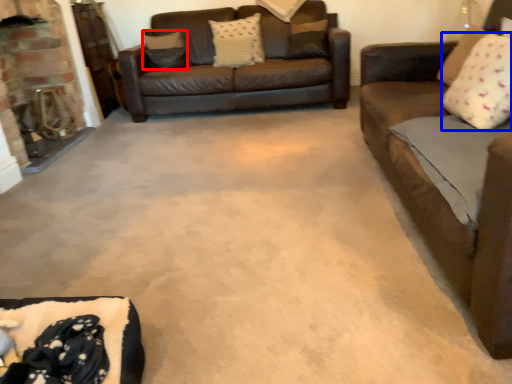
Question: Which object is closer to the camera taking this photo, pillow (highlighted by a red box) or pillow (highlighted by a blue box)?

Choices:
 (A) pillow
 (B) pillow

Answer: (B)